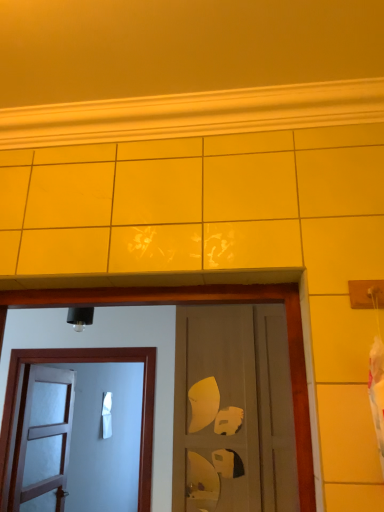
Question: In terms of height, does white wooden door at left, placed as the third door when sorted from right to left, look taller or shorter compared to white matte door at left, which appears as the second door when viewed from the right?

Choices:
 (A) short
 (B) tall

Answer: (B)

Question: From a real-world perspective, relative to white matte door at left, which appears as the second door when viewed from the right, is white wooden door at left, arranged as the first door when viewed from the left, vertically above or below?

Choices:
 (A) above
 (B) below

Answer: (B)

Question: Which object is positioned farthest from the white matte door at left, positioned as the second door in left-to-right order?

Choices:
 (A) matte brown door at center, placed as the 3th door when sorted from left to right
 (B) white wooden door at left, placed as the third door when sorted from right to left

Answer: (B)

Question: Estimate the real-world distances between objects in this image. Which object is farther from the white wooden door at left, placed as the third door when sorted from right to left?

Choices:
 (A) matte brown door at center, acting as the 1th door starting from the right
 (B) white matte door at left, positioned as the second door in left-to-right order

Answer: (A)